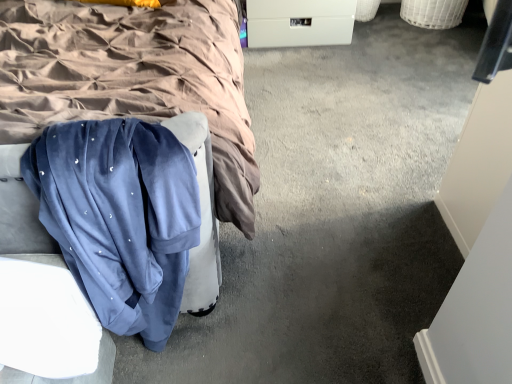
Find the location of a particular element. The image size is (512, 384). free spot to the right of white plastic drawer at center is located at coordinates (390, 38).